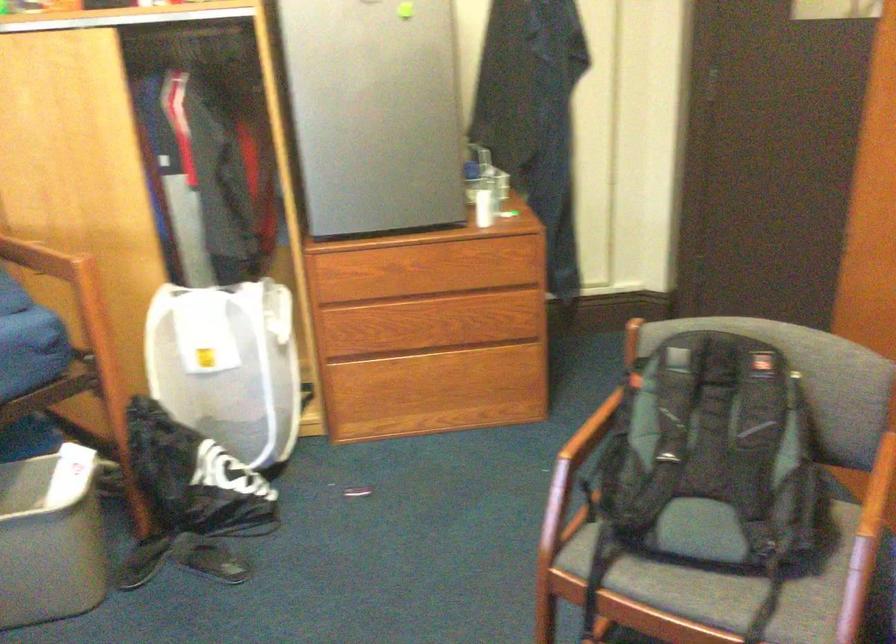
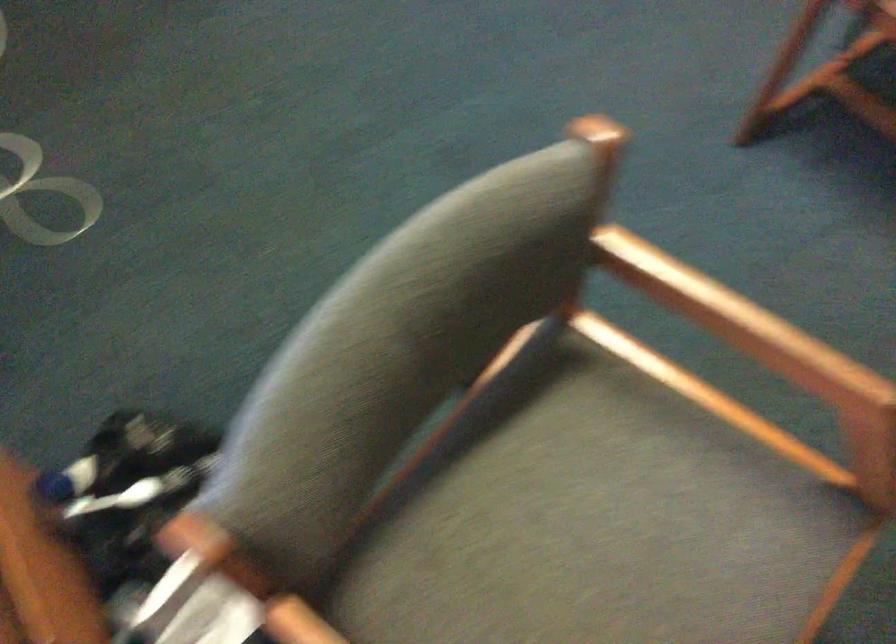
Question: The first image is from the beginning of the video and the second image is from the end. How did the camera likely rotate when shooting the video?

Choices:
 (A) Left
 (B) Right
 (C) Up
 (D) Down

Answer: (D)